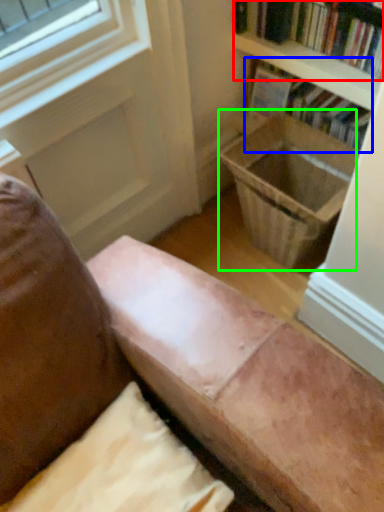
Question: Considering the real-world distances, which object is farthest from book (highlighted by a red box)? book (highlighted by a blue box) or laundry basket (highlighted by a green box)?

Choices:
 (A) book
 (B) laundry basket

Answer: (B)